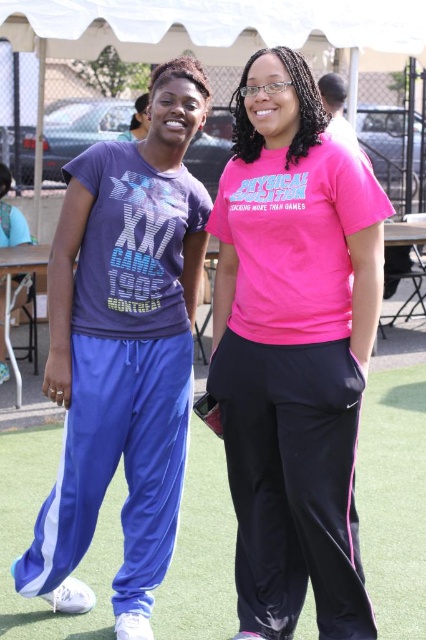
Does pink matte t-shirt at center have a smaller size compared to blue track pants at lower center?

Indeed, pink matte t-shirt at center has a smaller size compared to blue track pants at lower center.

Is pink matte t-shirt at center to the left of blue track pants at lower center from the viewer's perspective?

Indeed, pink matte t-shirt at center is positioned on the left side of blue track pants at lower center.

Is point (287, 632) positioned before point (9, 579)?

Yes, it is.

The width and height of the screenshot is (426, 640). Find the location of `pink matte t-shirt at center`. pink matte t-shirt at center is located at coordinates (293, 349).

Which is more to the right, matte purple t-shirt at left or blue track pants at lower center?

From the viewer's perspective, blue track pants at lower center appears more on the right side.

Can you confirm if matte purple t-shirt at left is shorter than blue track pants at lower center?

No, matte purple t-shirt at left is not shorter than blue track pants at lower center.

Where is `matte purple t-shirt at left`? Image resolution: width=426 pixels, height=640 pixels. matte purple t-shirt at left is located at coordinates (123, 352).

Is pink matte t-shirt at center closer to camera compared to matte purple t-shirt at left?

Yes.

Who is shorter, pink matte t-shirt at center or matte purple t-shirt at left?

Standing shorter between the two is pink matte t-shirt at center.

Identify the location of pink matte t-shirt at center. The width and height of the screenshot is (426, 640). (293, 349).